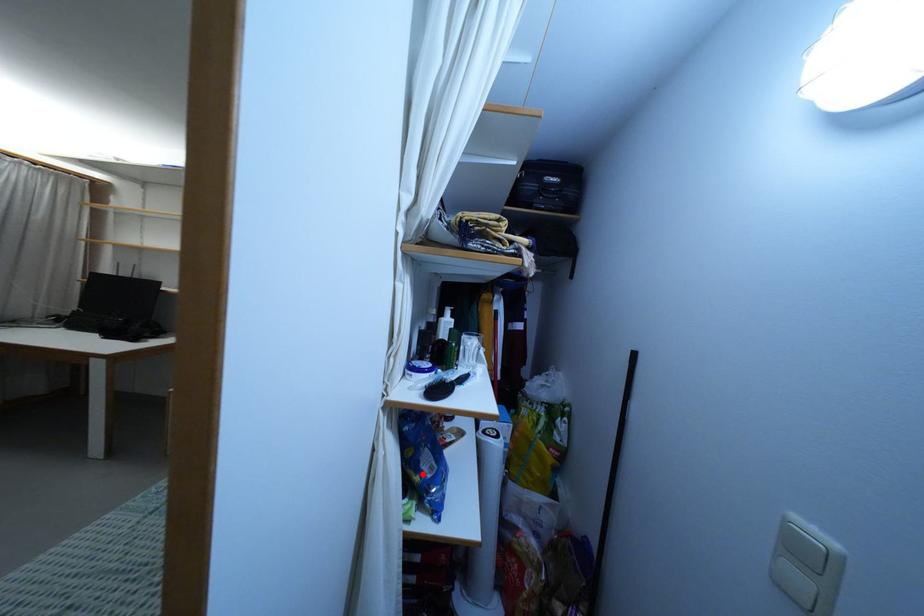
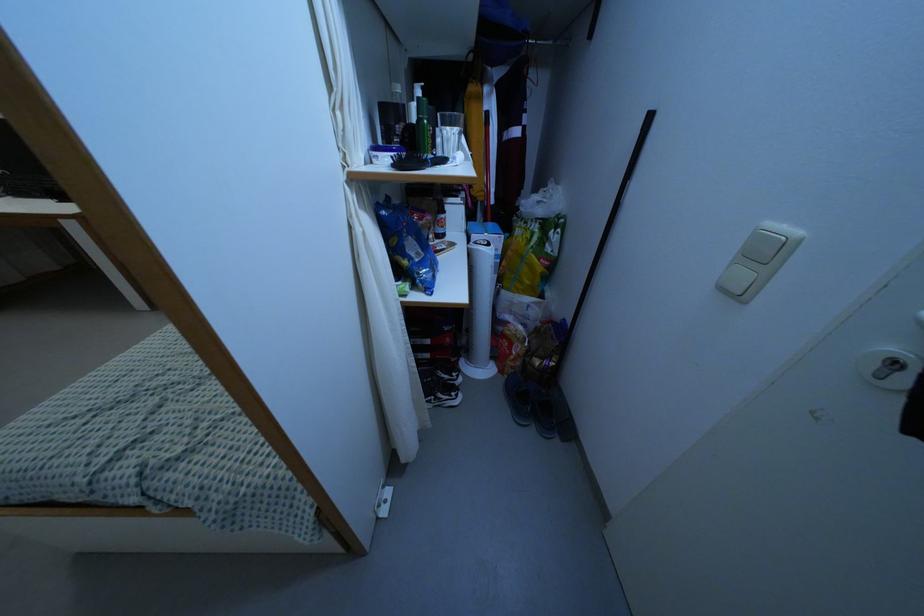
Question: I am providing you with two images of the same scene from different viewpoints. A red point is marked on the first image. Can you still see the location of the red point in image 2?

Choices:
 (A) Yes
 (B) No

Answer: (A)